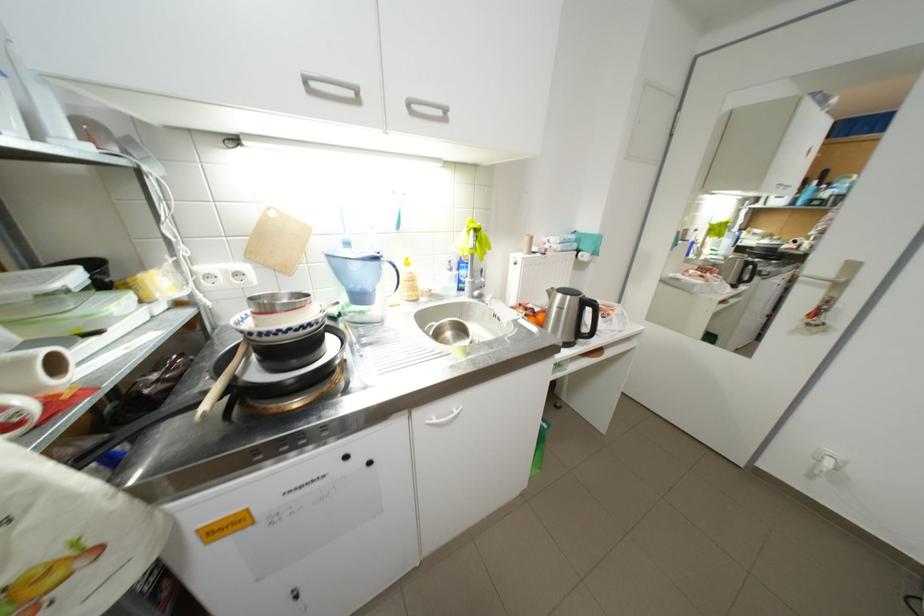
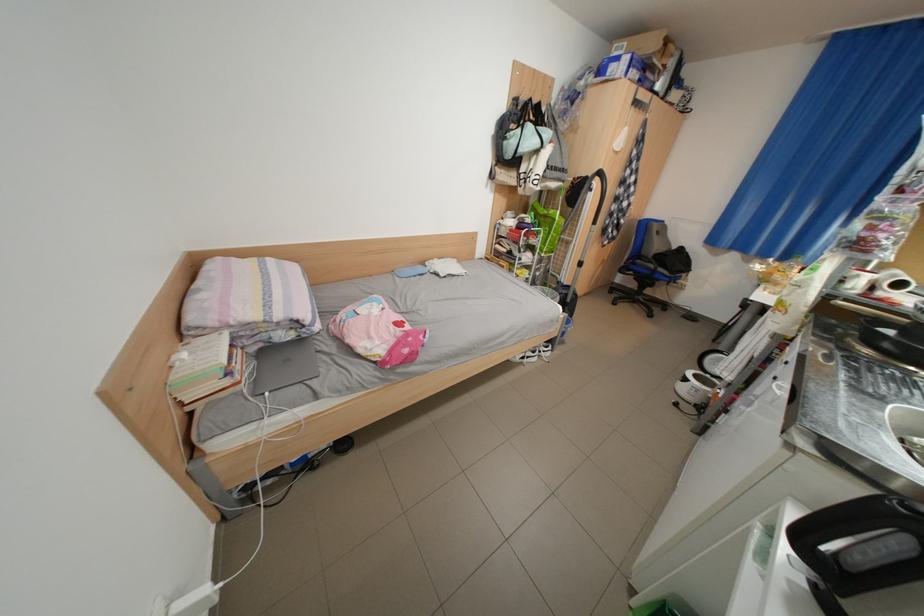
The point at (382, 464) is marked in the first image. Where is the corresponding point in the second image?

(786, 379)